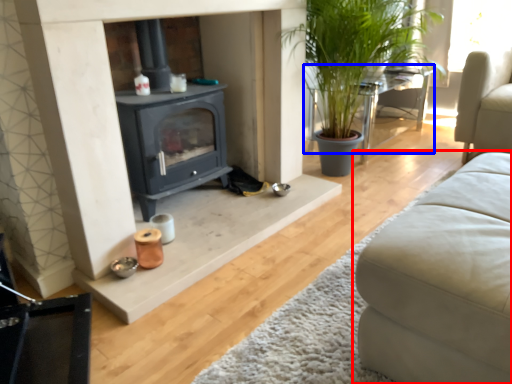
Question: Which point is closer to the camera, studio couch (highlighted by a red box) or table (highlighted by a blue box)?

Choices:
 (A) studio couch
 (B) table

Answer: (A)